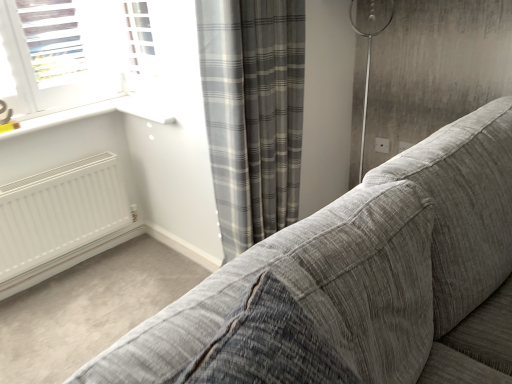
Question: From a real-world perspective, is textured gray fabric couch at center positioned above or below matte gray outlet at upper center?

Choices:
 (A) below
 (B) above

Answer: (B)

Question: Looking at the image, does textured gray fabric couch at center seem bigger or smaller compared to matte gray outlet at upper center?

Choices:
 (A) big
 (B) small

Answer: (A)

Question: Estimate the real-world distances between objects in this image. Which object is closer to the matte gray outlet at upper center?

Choices:
 (A) textured gray fabric couch at center
 (B) gray plaid curtain at center

Answer: (B)

Question: Estimate the real-world distances between objects in this image. Which object is farther from the textured gray fabric couch at center?

Choices:
 (A) gray plaid curtain at center
 (B) matte gray outlet at upper center

Answer: (B)